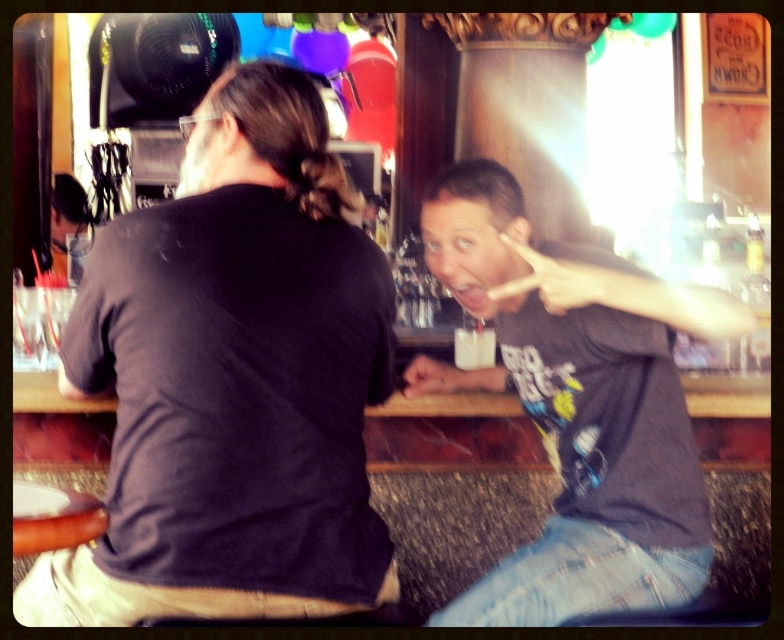
Question: Is black matte shirt at center above dark gray t-shirt at center?

Choices:
 (A) yes
 (B) no

Answer: (A)

Question: Where is black matte shirt at center located in relation to dark gray t-shirt at center in the image?

Choices:
 (A) above
 (B) below

Answer: (A)

Question: Is black matte shirt at center thinner than dark gray t-shirt at center?

Choices:
 (A) yes
 (B) no

Answer: (B)

Question: Which point is closer to the camera?

Choices:
 (A) (561, 460)
 (B) (231, 236)

Answer: (B)